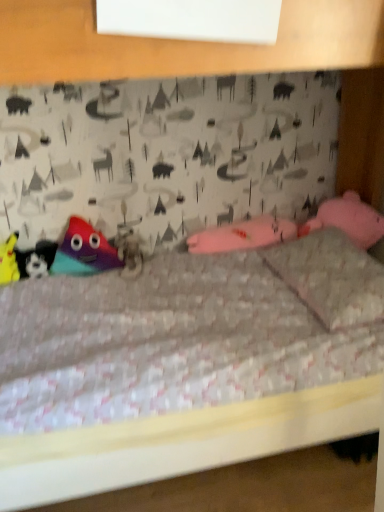
Where is `pink fabric pillow at upper right`? This screenshot has width=384, height=512. pink fabric pillow at upper right is located at coordinates pos(331,277).

Describe the element at coordinates (331, 277) in the screenshot. The width and height of the screenshot is (384, 512). I see `pink fabric pillow at upper right` at that location.

What do you see at coordinates (9, 261) in the screenshot? This screenshot has height=512, width=384. I see `yellow fabric toy at lower left, marked as the 3th toy in a right-to-left arrangement` at bounding box center [9, 261].

Based on the photo, measure the distance between multicolored plush toy at left, arranged as the 3th toy when viewed from the left, and camera.

multicolored plush toy at left, arranged as the 3th toy when viewed from the left, and camera are 5.95 feet apart from each other.

Identify the location of pink fabric pillow at upper right. (331, 277).

Identify the location of animal below the matte black plush at left, which is the 2th toy in left-to-right order (from a real-world perspective). (128, 252).

Could matte black plush at left, which is the 2th toy in left-to-right order, be considered to be inside fuzzy fabric animal at center?

That's incorrect, matte black plush at left, which is the 2th toy in left-to-right order, is not inside fuzzy fabric animal at center.

From the image's perspective, is fuzzy fabric animal at center positioned above or below matte black plush at left, which is counted as the second toy, starting from the right?

From the image's perspective, fuzzy fabric animal at center appears above matte black plush at left, which is counted as the second toy, starting from the right.

Relative to matte black plush at left, which is the 2th toy in left-to-right order, is fuzzy fabric animal at center in front or behind?

fuzzy fabric animal at center is positioned closer to the viewer than matte black plush at left, which is the 2th toy in left-to-right order.

Who is taller, pink fabric pillow at upper right or fuzzy fabric animal at center?

With more height is fuzzy fabric animal at center.

From a real-world perspective, does pink fabric pillow at upper right stand above fuzzy fabric animal at center?

Yes, from a real-world perspective, pink fabric pillow at upper right is on top of fuzzy fabric animal at center.

Does pink fabric pillow at upper right have a greater width compared to fuzzy fabric animal at center?

Yes, pink fabric pillow at upper right is wider than fuzzy fabric animal at center.

Would you say pink fabric pillow at upper right contains fuzzy fabric animal at center?

No.

From a real-world perspective, who is located lower, matte black plush at left, which is the 2th toy in left-to-right order, or yellow fabric toy at lower left, marked as the 3th toy in a right-to-left arrangement?

From a 3D spatial view, matte black plush at left, which is the 2th toy in left-to-right order, is below.

Do you think matte black plush at left, which is the 2th toy in left-to-right order, is within yellow fabric toy at lower left, marked as the 3th toy in a right-to-left arrangement, or outside of it?

The correct answer is: outside.

Is matte black plush at left, which is counted as the second toy, starting from the right, in front of or behind yellow fabric toy at lower left, marked as the 3th toy in a right-to-left arrangement, in the image?

matte black plush at left, which is counted as the second toy, starting from the right, is positioned farther from the viewer than yellow fabric toy at lower left, marked as the 3th toy in a right-to-left arrangement.

Who is bigger, matte black plush at left, which is counted as the second toy, starting from the right, or yellow fabric toy at lower left, marked as the 3th toy in a right-to-left arrangement?

With larger size is yellow fabric toy at lower left, marked as the 3th toy in a right-to-left arrangement.

Is point (118, 264) closer to viewer compared to point (340, 285)?

No, (118, 264) is further to viewer.

Could you tell me if multicolored plush toy at left, arranged as the 3th toy when viewed from the left, is turned towards pink fabric pillow at upper right?

No, multicolored plush toy at left, arranged as the 3th toy when viewed from the left, is not turned towards pink fabric pillow at upper right.

Considering their positions, is multicolored plush toy at left, arranged as the 3th toy when viewed from the left, located in front of or behind pink fabric pillow at upper right?

multicolored plush toy at left, arranged as the 3th toy when viewed from the left, is positioned farther from the viewer than pink fabric pillow at upper right.

Can you confirm if matte black plush at left, which is counted as the second toy, starting from the right, is positioned to the right of multicolored plush toy at left, arranged as the 3th toy when viewed from the left?

Incorrect, matte black plush at left, which is counted as the second toy, starting from the right, is not on the right side of multicolored plush toy at left, arranged as the 3th toy when viewed from the left.

Is multicolored plush toy at left, arranged as the 3th toy when viewed from the left, at the back of matte black plush at left, which is the 2th toy in left-to-right order?

No, matte black plush at left, which is the 2th toy in left-to-right order, is not facing away from multicolored plush toy at left, arranged as the 3th toy when viewed from the left.

Which is behind, point (35, 261) or point (101, 262)?

Point (101, 262)

From a real-world perspective, relative to multicolored plush toy at left, which ranks as the first toy in right-to-left order, is matte black plush at left, which is counted as the second toy, starting from the right, vertically above or below?

From a real-world perspective, matte black plush at left, which is counted as the second toy, starting from the right, is physically below multicolored plush toy at left, which ranks as the first toy in right-to-left order.

Who is bigger, multicolored plush toy at left, which ranks as the first toy in right-to-left order, or fuzzy fabric animal at center?

With larger size is multicolored plush toy at left, which ranks as the first toy in right-to-left order.

In terms of height, does multicolored plush toy at left, which ranks as the first toy in right-to-left order, look taller or shorter compared to fuzzy fabric animal at center?

In the image, multicolored plush toy at left, which ranks as the first toy in right-to-left order, appears to be taller than fuzzy fabric animal at center.

From the image's perspective, would you say multicolored plush toy at left, which ranks as the first toy in right-to-left order, is shown under fuzzy fabric animal at center?

No.

Locate an element on the screen. This screenshot has height=512, width=384. animal below the yellow fabric toy at lower left, the 1th toy positioned from the left (from a real-world perspective) is located at coordinates (128, 252).

Which object is positioned more to the left, yellow fabric toy at lower left, marked as the 3th toy in a right-to-left arrangement, or fuzzy fabric animal at center?

Positioned to the left is yellow fabric toy at lower left, marked as the 3th toy in a right-to-left arrangement.

Is the position of yellow fabric toy at lower left, marked as the 3th toy in a right-to-left arrangement, less distant than that of fuzzy fabric animal at center?

Yes, the depth of yellow fabric toy at lower left, marked as the 3th toy in a right-to-left arrangement, is less than that of fuzzy fabric animal at center.

Could you measure the distance between yellow fabric toy at lower left, marked as the 3th toy in a right-to-left arrangement, and fuzzy fabric animal at center?

The distance of yellow fabric toy at lower left, marked as the 3th toy in a right-to-left arrangement, from fuzzy fabric animal at center is 18.38 inches.

I want to click on the 1st toy directly above the fuzzy fabric animal at center (from a real-world perspective), so click(x=36, y=259).

Locate an element on the screen. animal lying above the pink fabric pillow at upper right (from the image's perspective) is located at coordinates (128, 252).

Estimate the real-world distances between objects in this image. Which object is closer to pink fabric pillow at upper right, fuzzy fabric animal at center or yellow fabric toy at lower left, marked as the 3th toy in a right-to-left arrangement?

Among the two, fuzzy fabric animal at center is located nearer to pink fabric pillow at upper right.

Based on their spatial positions, is fuzzy fabric animal at center or pink fabric pillow at upper right further from matte black plush at left, which is counted as the second toy, starting from the right?

Among the two, pink fabric pillow at upper right is located further to matte black plush at left, which is counted as the second toy, starting from the right.

Considering their positions, is fuzzy fabric animal at center positioned further to yellow fabric toy at lower left, marked as the 3th toy in a right-to-left arrangement, than pink fabric pillow at upper right?

pink fabric pillow at upper right is further to yellow fabric toy at lower left, marked as the 3th toy in a right-to-left arrangement.

Considering their positions, is fuzzy fabric animal at center positioned further to matte black plush at left, which is counted as the second toy, starting from the right, than multicolored plush toy at left, arranged as the 3th toy when viewed from the left?

Among the two, fuzzy fabric animal at center is located further to matte black plush at left, which is counted as the second toy, starting from the right.

Considering their positions, is pink fabric pillow at upper right positioned closer to multicolored plush toy at left, arranged as the 3th toy when viewed from the left, than matte black plush at left, which is the 2th toy in left-to-right order?

matte black plush at left, which is the 2th toy in left-to-right order, lies closer to multicolored plush toy at left, arranged as the 3th toy when viewed from the left, than the other object.

Based on their spatial positions, is matte black plush at left, which is the 2th toy in left-to-right order, or fuzzy fabric animal at center further from pink fabric pillow at upper right?

matte black plush at left, which is the 2th toy in left-to-right order.

Based on their spatial positions, is matte black plush at left, which is counted as the second toy, starting from the right, or yellow fabric toy at lower left, marked as the 3th toy in a right-to-left arrangement, closer to multicolored plush toy at left, which ranks as the first toy in right-to-left order?

matte black plush at left, which is counted as the second toy, starting from the right.

From the image, which object appears to be nearer to matte black plush at left, which is the 2th toy in left-to-right order, yellow fabric toy at lower left, marked as the 3th toy in a right-to-left arrangement, or multicolored plush toy at left, which ranks as the first toy in right-to-left order?

yellow fabric toy at lower left, marked as the 3th toy in a right-to-left arrangement.

Locate an element on the screen. This screenshot has width=384, height=512. animal situated between matte black plush at left, which is counted as the second toy, starting from the right, and pink fabric pillow at upper right from left to right is located at coordinates (128, 252).

Locate an element on the screen. This screenshot has width=384, height=512. toy between matte black plush at left, which is the 2th toy in left-to-right order, and pink fabric pillow at upper right, in the horizontal direction is located at coordinates (84, 251).

Locate an element on the screen. This screenshot has height=512, width=384. toy between matte black plush at left, which is counted as the second toy, starting from the right, and fuzzy fabric animal at center from left to right is located at coordinates (84, 251).

At what (x,y) coordinates should I click in order to perform the action: click on animal situated between yellow fabric toy at lower left, the 1th toy positioned from the left, and pink fabric pillow at upper right from left to right. Please return your answer as a coordinate pair (x, y). The image size is (384, 512). Looking at the image, I should click on (128, 252).